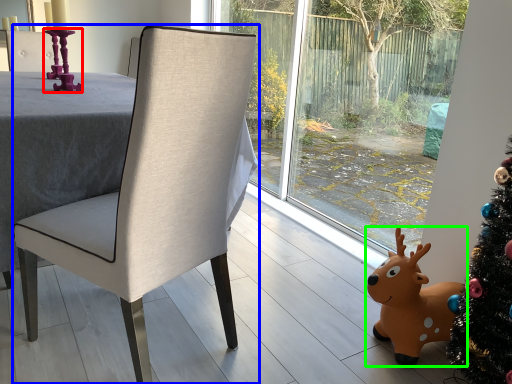
Question: Based on their relative distances, which object is farther from candle holder (highlighted by a red box)? Choose from chair (highlighted by a blue box) and deer (highlighted by a green box).

Choices:
 (A) chair
 (B) deer

Answer: (B)